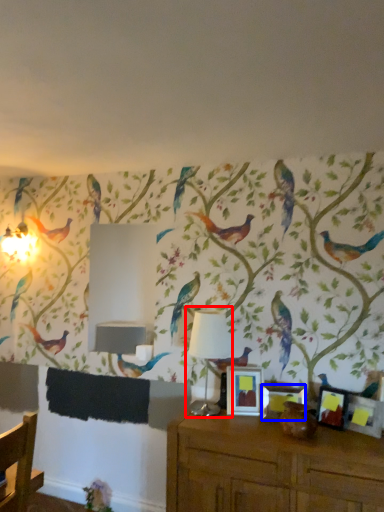
Question: Which object appears farthest to the camera in this image, table lamp (highlighted by a red box) or picture frame (highlighted by a blue box)?

Choices:
 (A) table lamp
 (B) picture frame

Answer: (A)